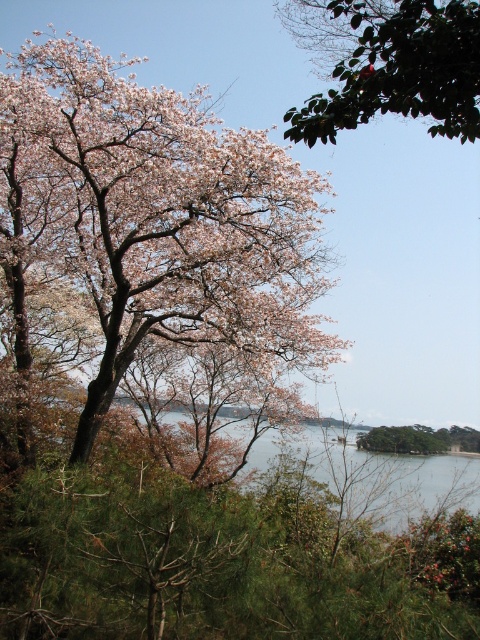
You are an artist painting the scene and want to ensure the pink matte flower at upper left and green glossy leaf at upper center are proportionally accurate. Which object should you draw taller in your painting?

The pink matte flower at upper left should be drawn taller than the green glossy leaf at upper center because it has a greater height according to the description.

You are an artist sketching the scene and want to ensure the pink matte flower at upper left and the green glossy leaf at upper center are proportionally accurate. Which object should you draw first to maintain the correct size relationship?

You should draw the pink matte flower at upper left first since it is larger than the green glossy leaf at upper center, ensuring proper scaling before adding smaller details.